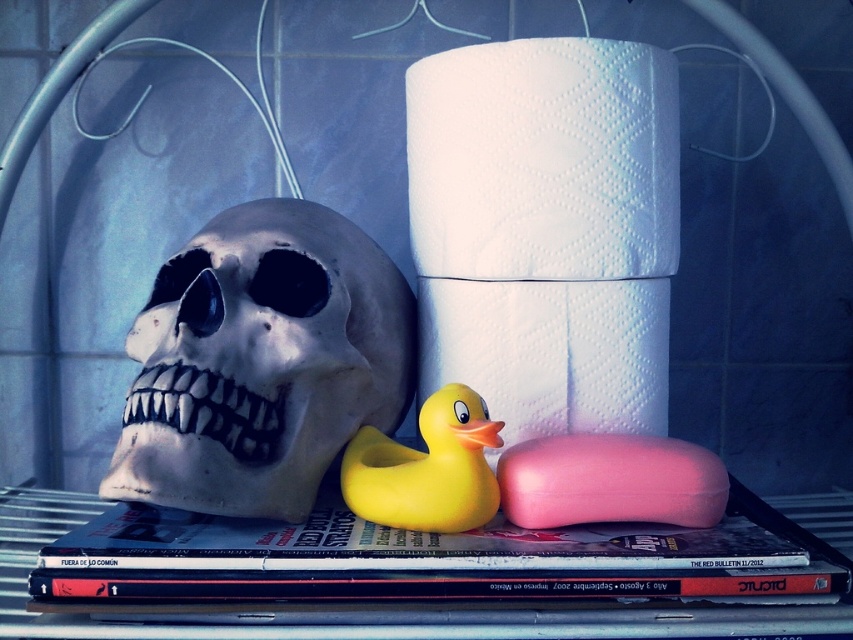
Which of these two, pink matte soap at center or yellow rubber duck at center, stands shorter?

Standing shorter between the two is pink matte soap at center.

Where is `pink matte soap at center`? The width and height of the screenshot is (853, 640). pink matte soap at center is located at coordinates (610, 481).

Image resolution: width=853 pixels, height=640 pixels. Identify the location of pink matte soap at center. click(x=610, y=481).

Is point (485, 296) positioned in front of point (521, 449)?

No, (485, 296) is further to viewer.

Looking at this image, which is more to the left, white paper towel at center or pink matte soap at center?

From the viewer's perspective, white paper towel at center appears more on the left side.

Where is `white paper towel at center`? The height and width of the screenshot is (640, 853). white paper towel at center is located at coordinates (546, 228).

The width and height of the screenshot is (853, 640). Find the location of `white paper towel at center`. white paper towel at center is located at coordinates (546, 228).

Is white matte skull at left to the left of hardcover book at center from the viewer's perspective?

Indeed, white matte skull at left is positioned on the left side of hardcover book at center.

Between white matte skull at left and hardcover book at center, which one is positioned higher?

white matte skull at left

What are the coordinates of `white matte skull at left` in the screenshot? It's located at (260, 362).